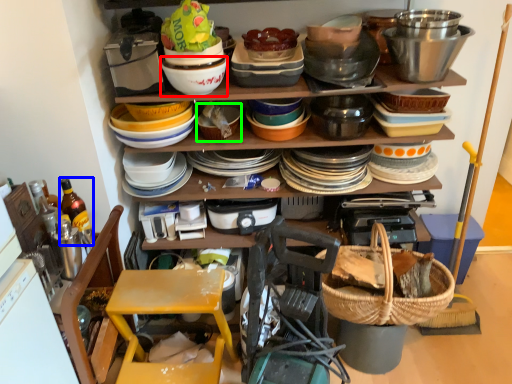
Question: Which object is positioned farthest from bowl (highlighted by a red box)? Select from bottle (highlighted by a blue box) and basket (highlighted by a green box).

Choices:
 (A) bottle
 (B) basket

Answer: (A)